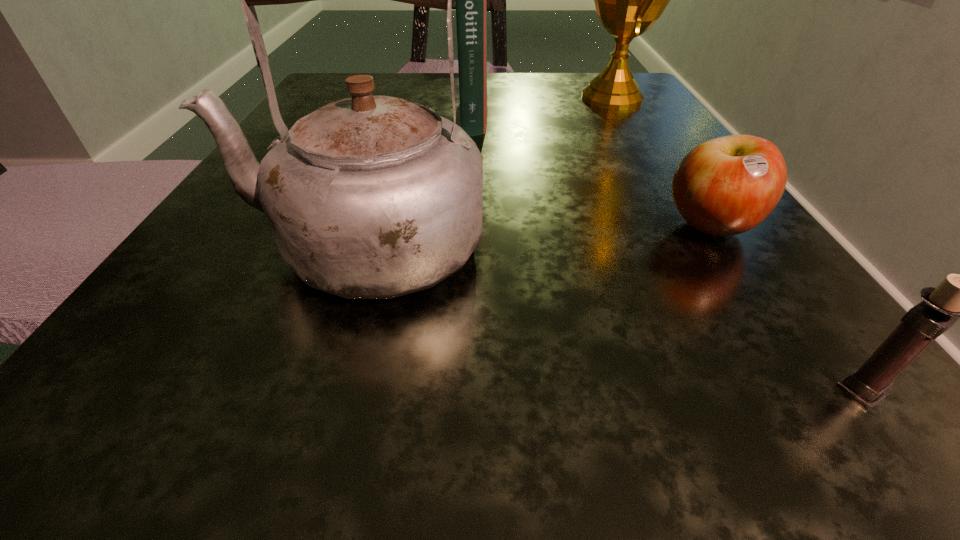
The height and width of the screenshot is (540, 960). In order to click on vacant space located 0.090m on the left of the nearest object in this screenshot , I will do `click(728, 390)`.

Find the location of a particular element. The image size is (960, 540). free location located on the back of the apple is located at coordinates (634, 112).

Locate an element on the screen. The height and width of the screenshot is (540, 960). award that is positioned at the far edge is located at coordinates (629, 0).

Image resolution: width=960 pixels, height=540 pixels. I want to click on hardback book located in the far edge section of the desktop, so click(471, 10).

I want to click on object situated at the near edge, so click(957, 297).

Locate an element on the screen. The width and height of the screenshot is (960, 540). object located at the left edge is located at coordinates (371, 197).

This screenshot has height=540, width=960. Identify the location of award that is positioned at the right edge. (629, 0).

Where is `candle holder that is positioned at the right edge`? candle holder that is positioned at the right edge is located at coordinates (957, 297).

This screenshot has width=960, height=540. In order to click on apple located at the right edge in this screenshot , I will do `click(725, 186)`.

In order to click on object that is at the far right corner in this screenshot , I will do tap(629, 0).